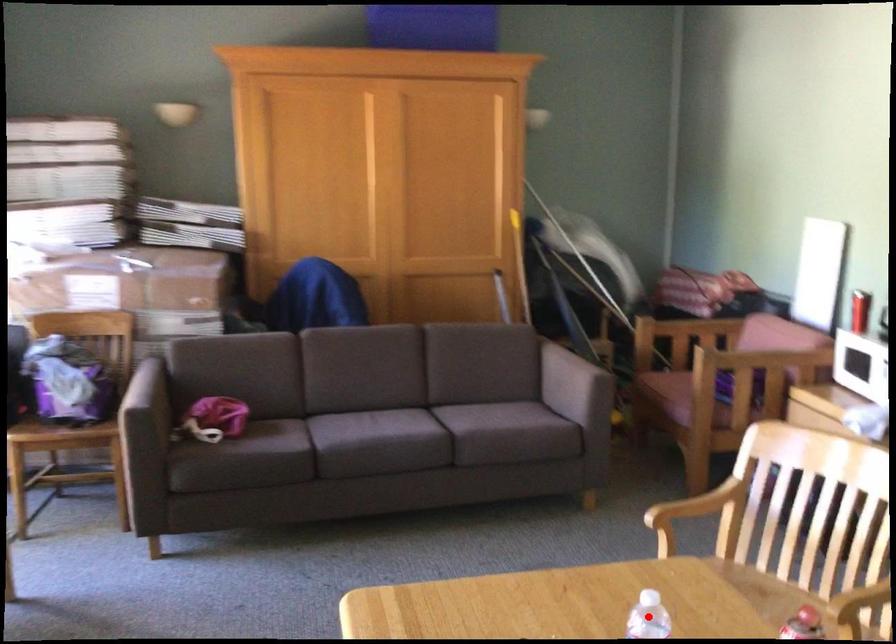
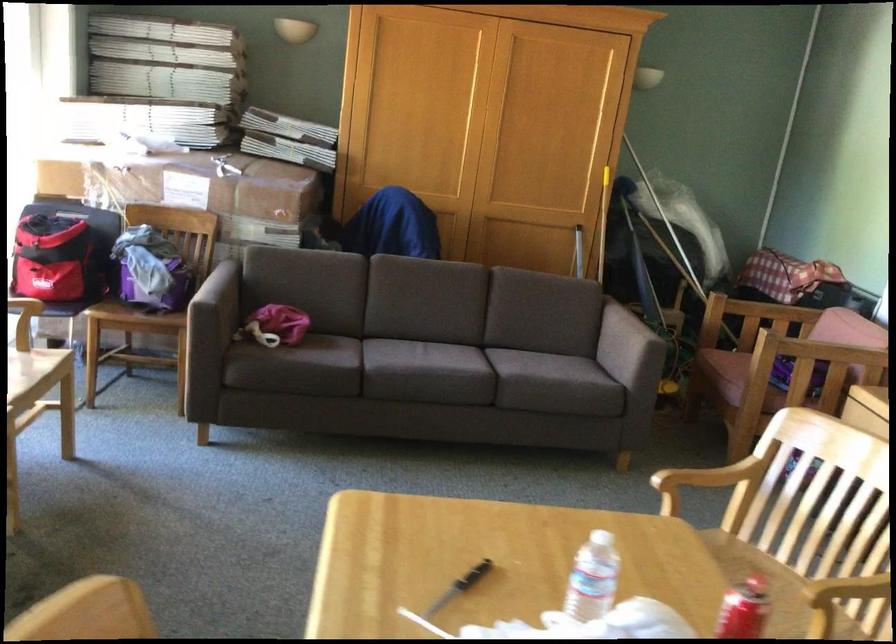
Locate, in the second image, the point that corresponds to the highlighted location in the first image.

(617, 562)